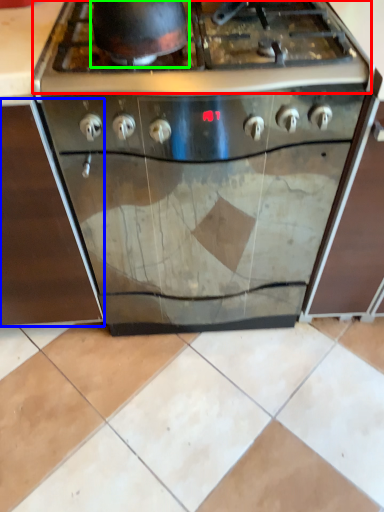
Question: Which is farther away from gas stove (highlighted by a red box)? cabinetry (highlighted by a blue box) or wok (highlighted by a green box)?

Choices:
 (A) cabinetry
 (B) wok

Answer: (A)